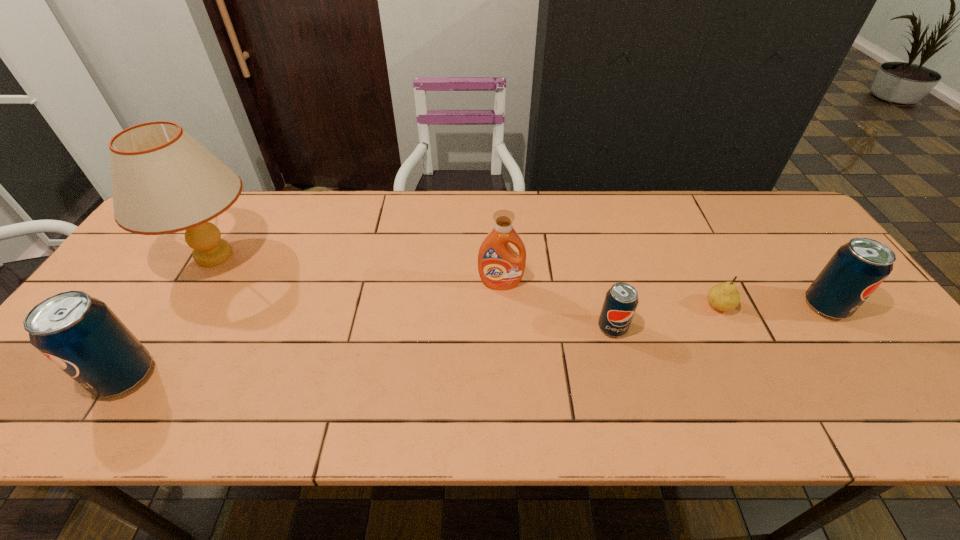
At what (x,y) coordinates should I click in order to perform the action: click on the nearest object. Please return your answer as a coordinate pair (x, y). This screenshot has height=540, width=960. Looking at the image, I should click on (80, 334).

I want to click on the nearest soda can, so click(x=80, y=334).

This screenshot has height=540, width=960. I want to click on the third object from right to left, so click(621, 300).

Locate an element on the screen. This screenshot has height=540, width=960. the shortest soda can is located at coordinates (621, 300).

Where is `the rightmost object`? The height and width of the screenshot is (540, 960). the rightmost object is located at coordinates (855, 271).

Where is `the fourth tallest object`? the fourth tallest object is located at coordinates 855,271.

Where is `the shortest object`? The width and height of the screenshot is (960, 540). the shortest object is located at coordinates (724, 296).

The image size is (960, 540). What are the coordinates of `the fifth object from left to right` in the screenshot? It's located at (724, 296).

Image resolution: width=960 pixels, height=540 pixels. Find the location of `lampshade`. lampshade is located at coordinates (164, 181).

Locate an element on the screen. The image size is (960, 540). the third object from left to right is located at coordinates (500, 268).